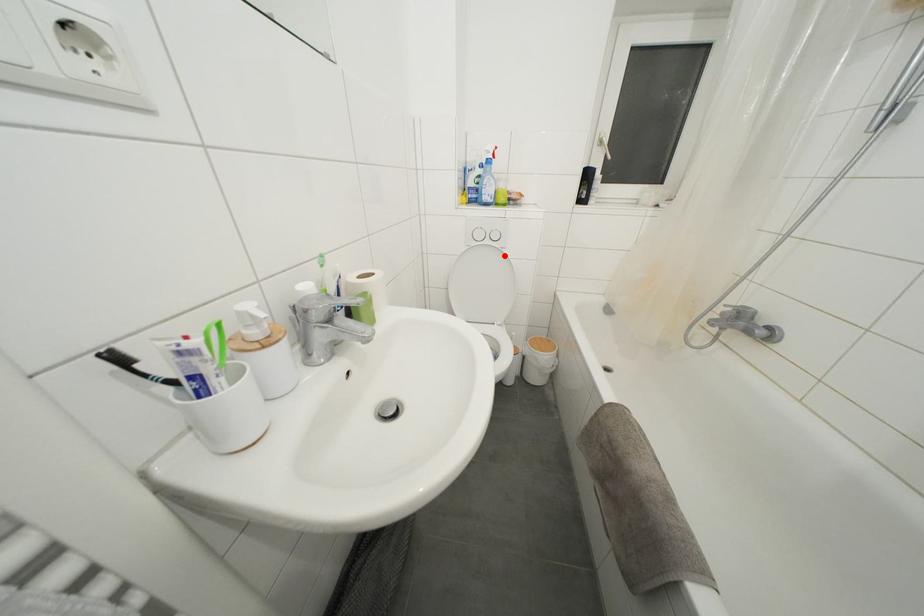
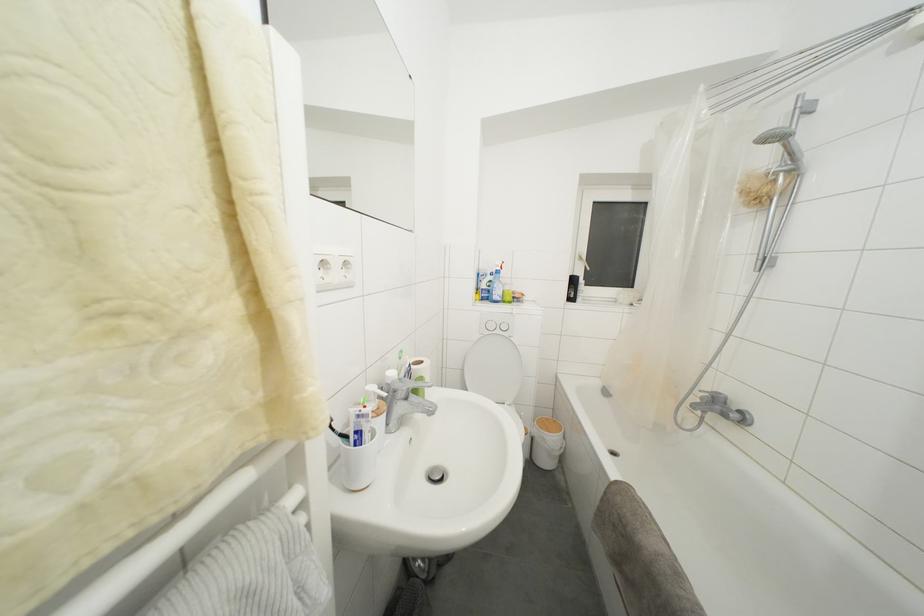
In the second image, find the point that corresponds to the highlighted location in the first image.

(513, 344)